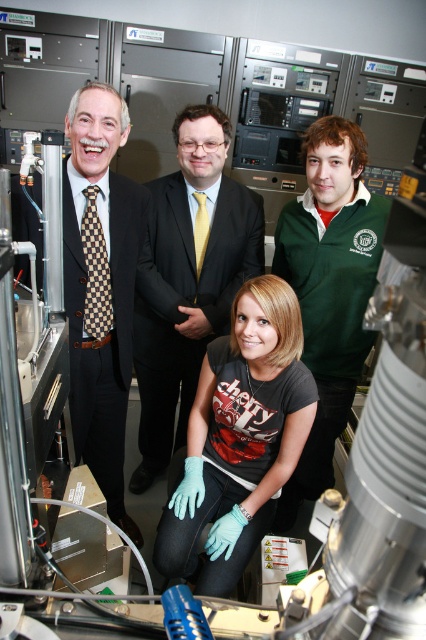
In the laboratory scene, you notice the teal fabric gloves at lower center and the matte black suit at left. Based on their positions, which object is located to the right of the other?

The teal fabric gloves at lower center are to the right of the matte black suit at left.

You are a safety inspector in the lab and need to ensure that the teal fabric gloves at lower center and the green fleece jacket at upper right are properly positioned. According to the safety protocol, items must be arranged so that the glove is not blocking the jacket. Is the current arrangement compliant?

The teal fabric gloves at lower center is in front of green fleece jacket at upper right, which means it is blocking the jacket. This violates the safety protocol requirement that the glove should not block the jacket. The current arrangement is not compliant.

You are a researcher in the lab and need to locate the teal fabric gloves at lower center. Based on the coordinates provided, can you determine their position relative to the center of the image?

The teal fabric gloves at lower center are located at coordinates point [239,438]. Since the center of the image is at point [213,320], the gloves are positioned to the right and slightly above the center of the image.